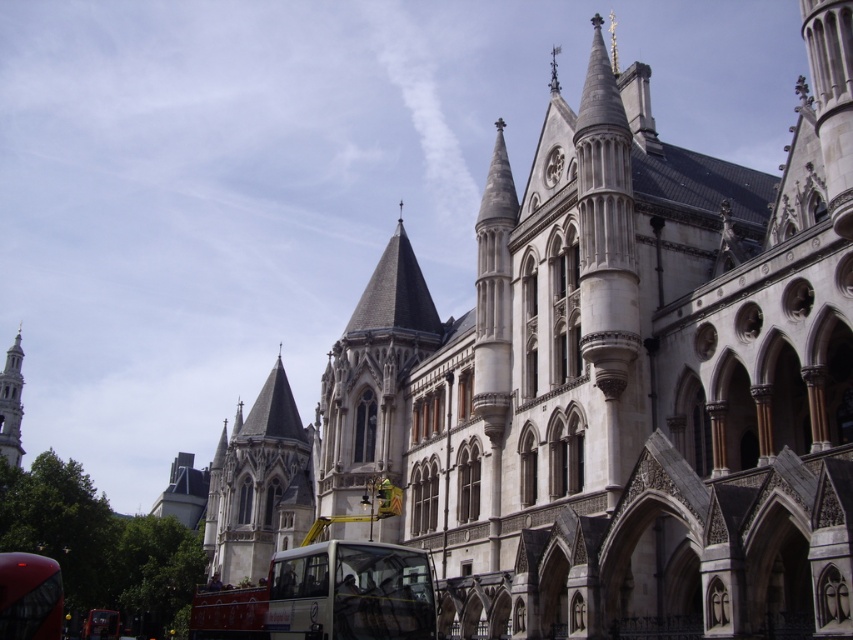
Question: Can you confirm if stone gothic tower at center-left is wider than silver metallic spire at left?

Choices:
 (A) no
 (B) yes

Answer: (B)

Question: Which of these objects is positioned closest to the stone gothic tower at center-left?

Choices:
 (A) silver metallic spire at left
 (B) shiny red bus at lower left

Answer: (B)

Question: In this image, where is shiny red bus at lower left located relative to silver metallic spire at left?

Choices:
 (A) left
 (B) right

Answer: (B)

Question: Is stone gothic tower at center-left positioned at the back of shiny red bus at lower left?

Choices:
 (A) no
 (B) yes

Answer: (B)

Question: Which object is closer to the camera taking this photo?

Choices:
 (A) silver metallic spire at left
 (B) stone gothic tower at center-left
 (C) shiny red bus at lower left

Answer: (C)

Question: Which object is positioned closest to the shiny red bus at lower left?

Choices:
 (A) silver metallic spire at left
 (B) stone gothic tower at center-left

Answer: (B)